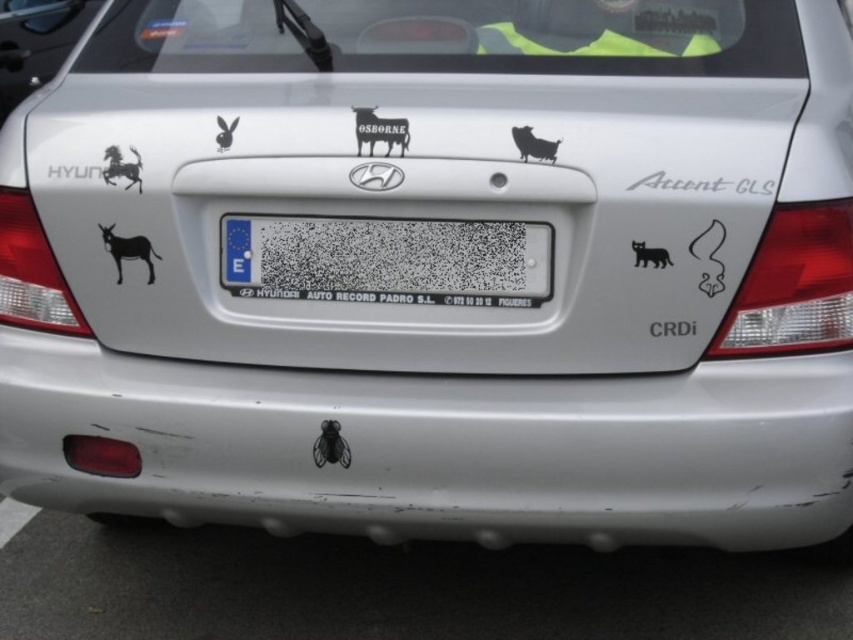
In the scene shown: Can you confirm if black glossy fly at lower center is positioned to the left of black matte pig at upper center?

Yes, black glossy fly at lower center is to the left of black matte pig at upper center.

Does black glossy fly at lower center appear under black matte pig at upper center?

Yes, black glossy fly at lower center is below black matte pig at upper center.

Locate an element on the screen. This screenshot has width=853, height=640. black glossy fly at lower center is located at coordinates (329, 445).

Can you confirm if black matte cow at center is taller than black glossy fly at lower center?

Yes, black matte cow at center is taller than black glossy fly at lower center.

Who is taller, black matte cow at center or black glossy fly at lower center?

black matte cow at center is taller.

Is point (355, 132) behind point (321, 452)?

No, it is in front of (321, 452).

Where is `black matte cow at center`? black matte cow at center is located at coordinates click(379, 131).

Measure the distance between white matte bumper at lower center and black matte cow at center.

white matte bumper at lower center is 1.30 meters from black matte cow at center.

Is white matte bumper at lower center in front of black matte cow at center?

That is False.

Is point (822, 576) positioned before point (397, 125)?

No, (822, 576) is further to viewer.

At what (x,y) coordinates should I click in order to perform the action: click on white matte bumper at lower center. Please return your answer as a coordinate pair (x, y). The height and width of the screenshot is (640, 853). Looking at the image, I should click on (396, 588).